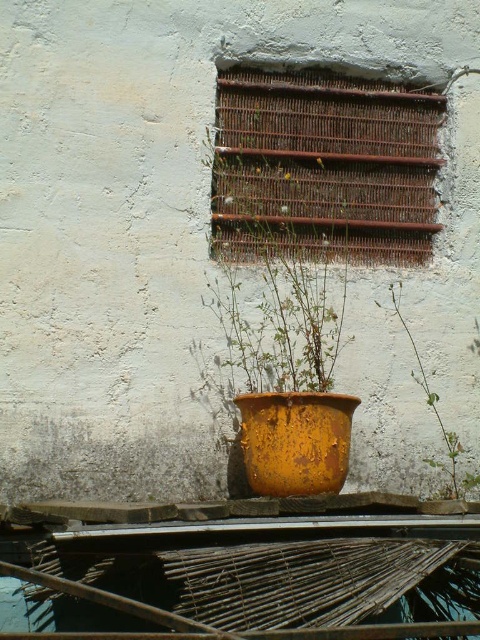
You are standing in front of the weathered wall and want to place a new decoration exactly at the same position as the rusty metal pot at center. According to the image, what are the coordinates where you should place your decoration?

The coordinates for the rusty metal pot at center are at point (295, 442), so you should place your decoration at those coordinates.

You are a gardener who wants to water the green leafy plant at center. However, you notice the rusty metal pot at center is blocking your access to the plant. Can you move the pot to the side to reach the plant?

The rusty metal pot at center is in front of the green leafy plant at center, so moving it aside would allow access to the plant.